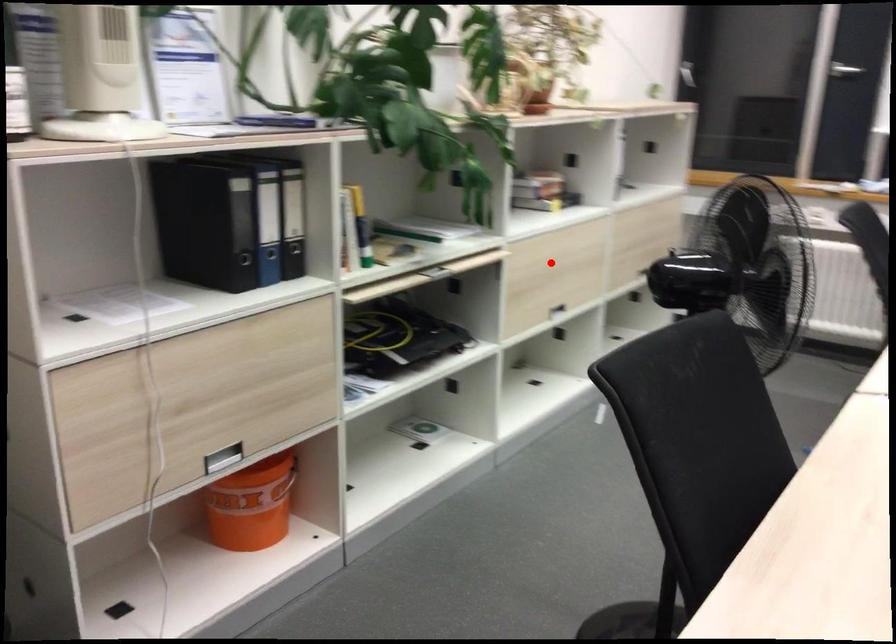
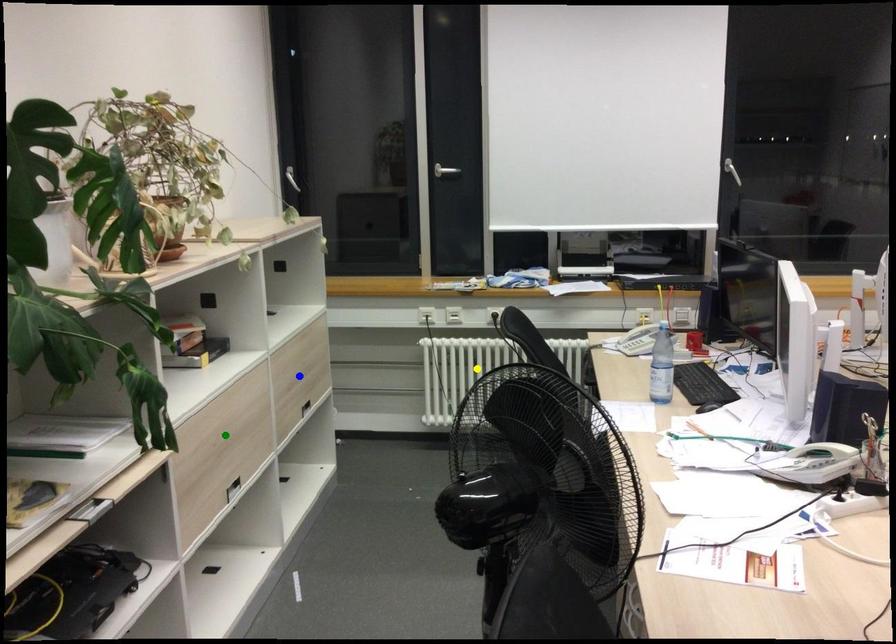
Question: I am providing you with two images of the same scene from different viewpoints. A red point is marked on the first image. You are given multiple points on the second image. Which point in image 2 is actually the same real-world point as the red point in image 1?

Choices:
 (A) blue point
 (B) green point
 (C) yellow point

Answer: (B)